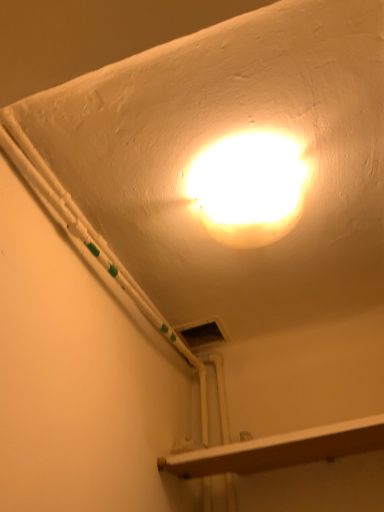
Question: Relative to wooden at lower right, is white glossy light fixture at upper center in front or behind?

Choices:
 (A) behind
 (B) front

Answer: (B)

Question: Visually, is white glossy light fixture at upper center positioned to the left or to the right of wooden at lower right?

Choices:
 (A) left
 (B) right

Answer: (A)

Question: Is white glossy light fixture at upper center taller or shorter than wooden at lower right?

Choices:
 (A) short
 (B) tall

Answer: (B)

Question: Looking at their shapes, would you say wooden at lower right is wider or thinner than white glossy light fixture at upper center?

Choices:
 (A) wide
 (B) thin

Answer: (A)

Question: In terms of height, does wooden at lower right look taller or shorter compared to white glossy light fixture at upper center?

Choices:
 (A) short
 (B) tall

Answer: (A)

Question: Is point (312, 446) positioned closer to the camera than point (215, 236)?

Choices:
 (A) closer
 (B) farther

Answer: (B)

Question: Based on their positions, is wooden at lower right located to the left or right of white glossy light fixture at upper center?

Choices:
 (A) right
 (B) left

Answer: (A)